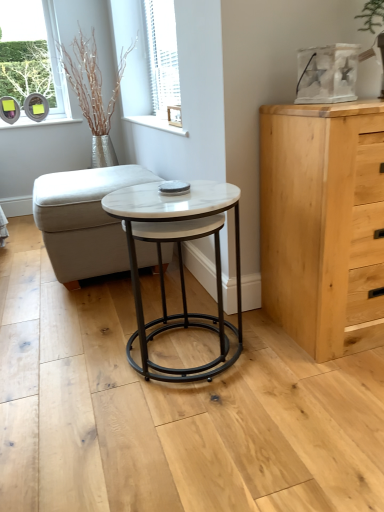
Locate an element on the screen. The height and width of the screenshot is (512, 384). vacant space to the left of white marble coffee table at center is located at coordinates [x=61, y=367].